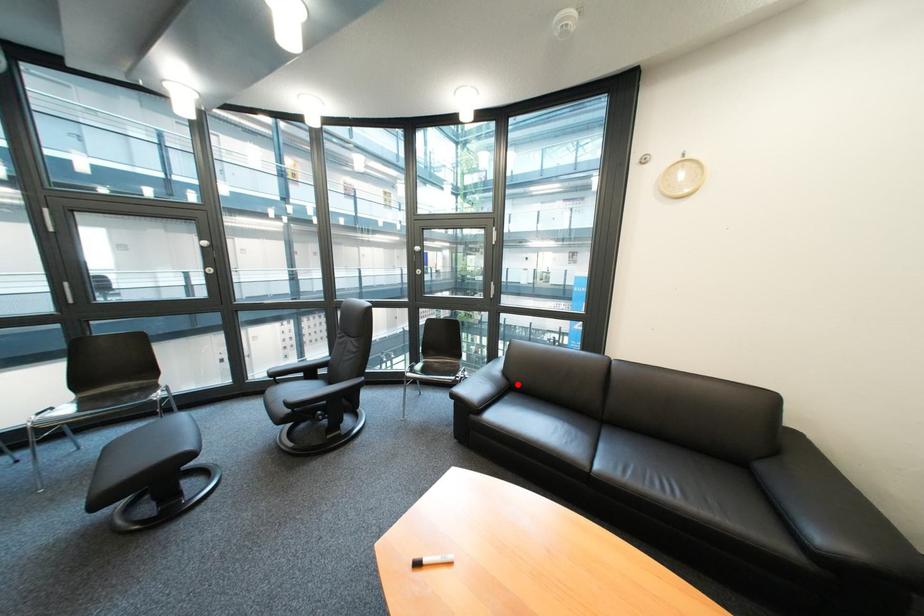
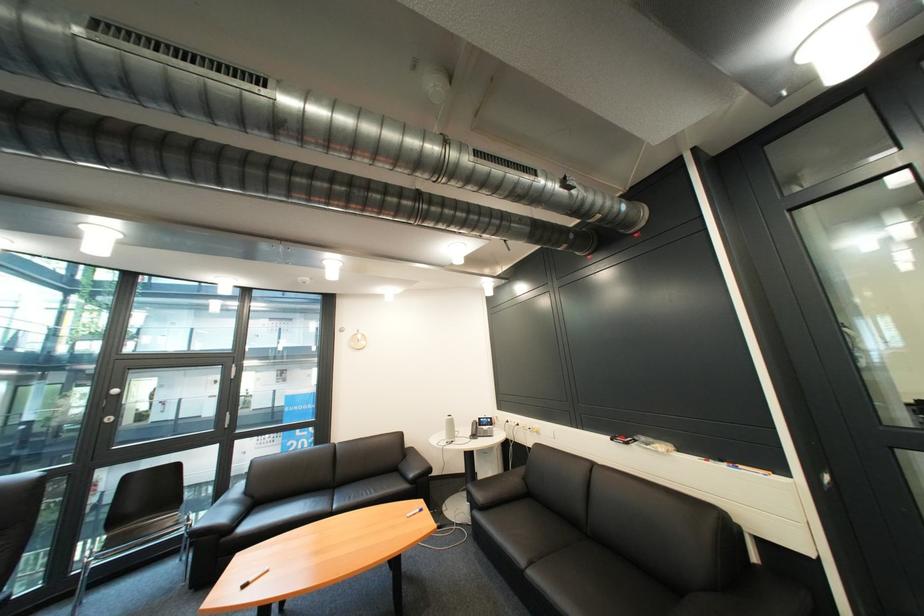
Question: A red point is marked in image1. In image2, is the corresponding 3D point closer to the camera or farther? Reply with the corresponding letter.

Choices:
 (A) The corresponding 3D point is closer.
 (B) The corresponding 3D point is farther.

Answer: (A)